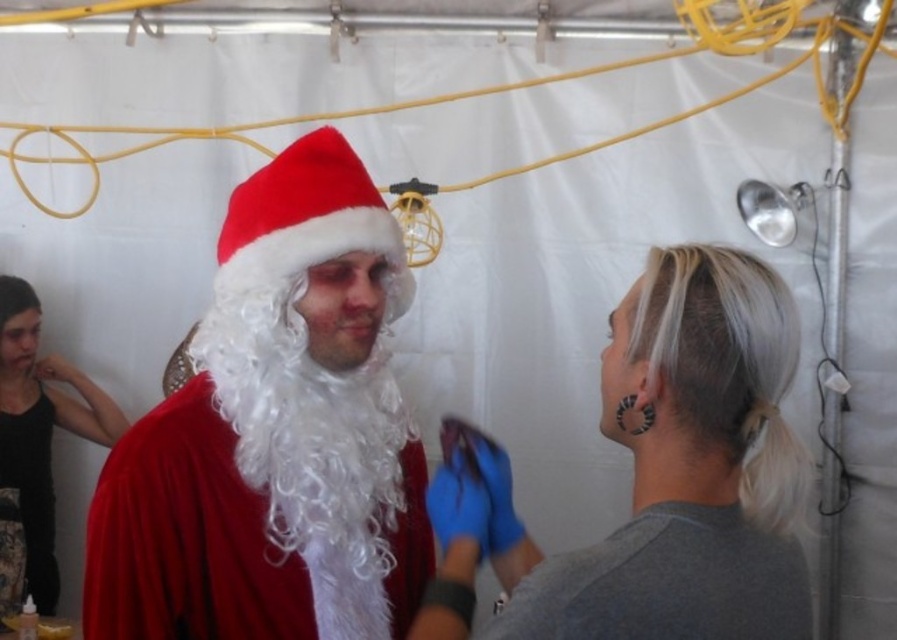
In the scene shown: You are a photographer trying to capture a clear photo of the velvet red santa claus at center and the white fluffy beard at center. Which object should you focus on first to ensure both are in focus?

You should focus on the velvet red santa claus at center first because it is closer to the viewer than the white fluffy beard at center, so adjusting focus from the closer object to the farther one will help both be in focus.

You are standing in front of the Santa Claus costume and want to place a decoration at point A and point B. The coordinates for point A are point(173, 486) and point B are point(375, 310). Which point is closer to you?

Point(173, 486) is closer to the viewer than point(375, 310).